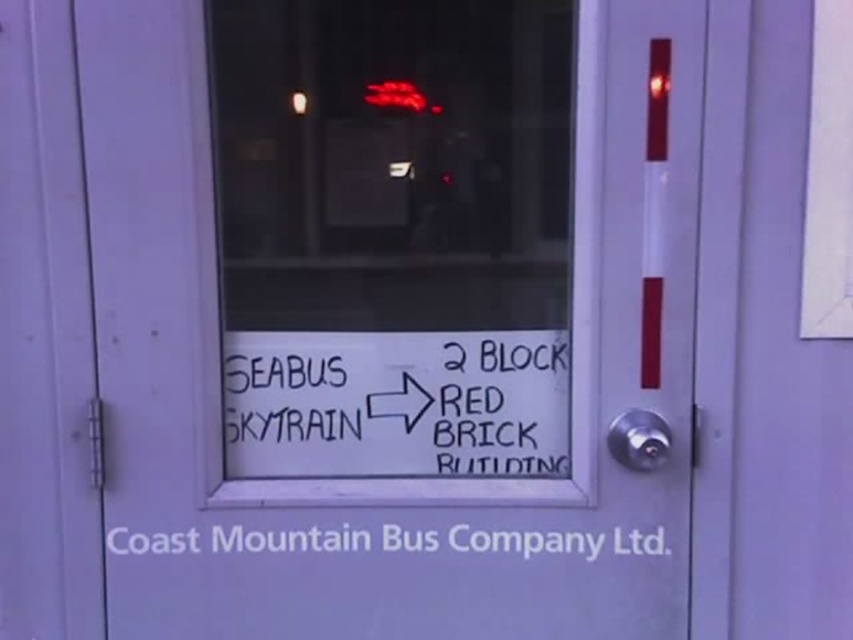
You are standing in front of the Coast Mountain Bus Company Ltd. door and want to locate the white paper sign at center. Based on the door layout described, where should you look relative to the door?

The white paper sign at center is located at the center of the door, specifically at the coordinates point (407,250), which would be near the middle section of the door.